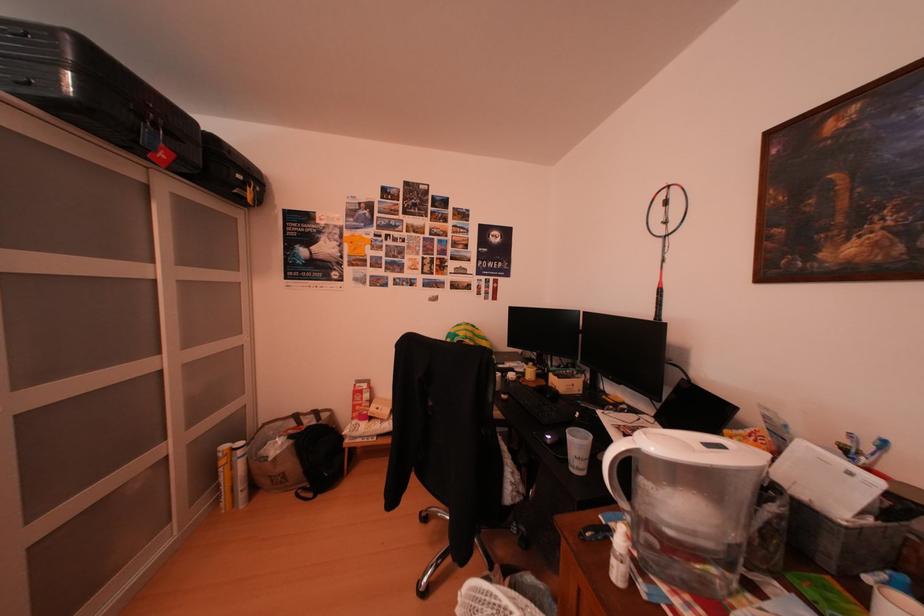
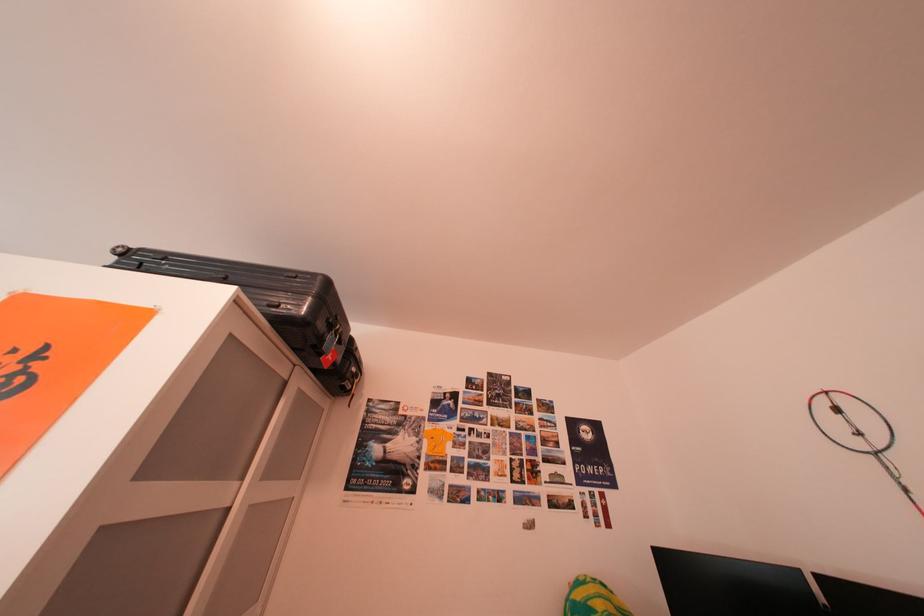
Question: How did the camera likely rotate?

Choices:
 (A) Left
 (B) Right
 (C) Up
 (D) Down

Answer: (C)